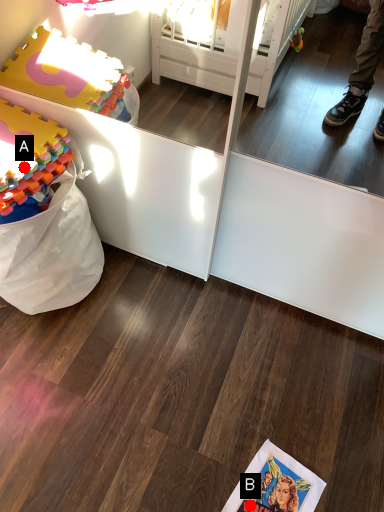
Question: Two points are circled on the image, labeled by A and B beside each circle. Which point is closer to the camera?

Choices:
 (A) A is closer
 (B) B is closer

Answer: (A)